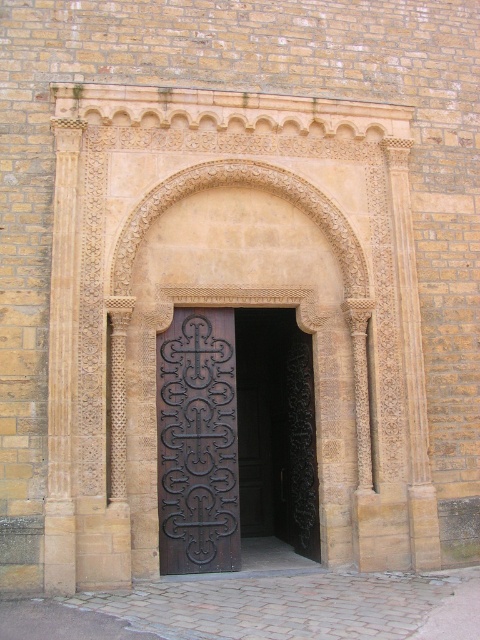
Question: Among these objects, which one is nearest to the camera?

Choices:
 (A) dark brown wrought iron door at center
 (B) dark wood door at center

Answer: (B)

Question: Where is dark wood door at center located in relation to dark brown wrought iron door at center in the image?

Choices:
 (A) right
 (B) left

Answer: (A)

Question: Can you confirm if dark wood door at center is wider than dark brown wrought iron door at center?

Choices:
 (A) yes
 (B) no

Answer: (A)

Question: Which of the following is the farthest from the observer?

Choices:
 (A) (200, 509)
 (B) (257, 372)

Answer: (B)

Question: In this image, where is dark wood door at center located relative to dark brown wrought iron door at center?

Choices:
 (A) left
 (B) right

Answer: (B)